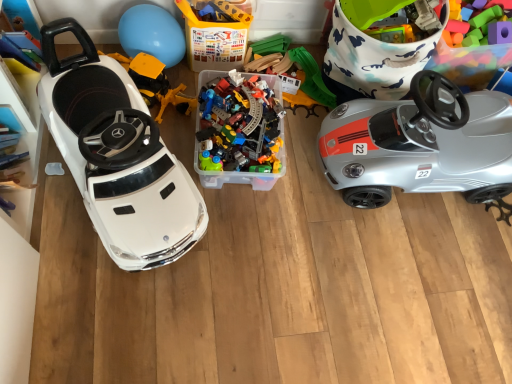
Question: From the image's perspective, is blue rubber balloon at upper center positioned above or below rubberized plastic steering wheel at upper right, acting as the 1th toy starting from the right?

Choices:
 (A) above
 (B) below

Answer: (B)

Question: In terms of height, does blue rubber balloon at upper center look taller or shorter compared to rubberized plastic steering wheel at upper right, acting as the 1th toy starting from the right?

Choices:
 (A) tall
 (B) short

Answer: (B)

Question: Which is farther from the blue rubber balloon at upper center?

Choices:
 (A) white plastic car at left, which is the 2th car from right to left
 (B) yellow plastic construction vehicle at left, which is counted as the first toy, starting from the left
 (C) translucent plastic train set at center, the 2th toy positioned from the left
 (D) translucent plastic container at center
 (E) rubberized plastic steering wheel at upper right, acting as the third toy starting from the left

Answer: (E)

Question: Which object is the farthest from the translucent plastic container at center?

Choices:
 (A) white plastic car at left, which is the 2th car from right to left
 (B) yellow plastic construction vehicle at left, the third toy in the right-to-left sequence
 (C) silver metallic car at right, marked as the second car in a left-to-right arrangement
 (D) translucent plastic train set at center, the 2th toy positioned from the left
 (E) blue rubber balloon at upper center

Answer: (C)